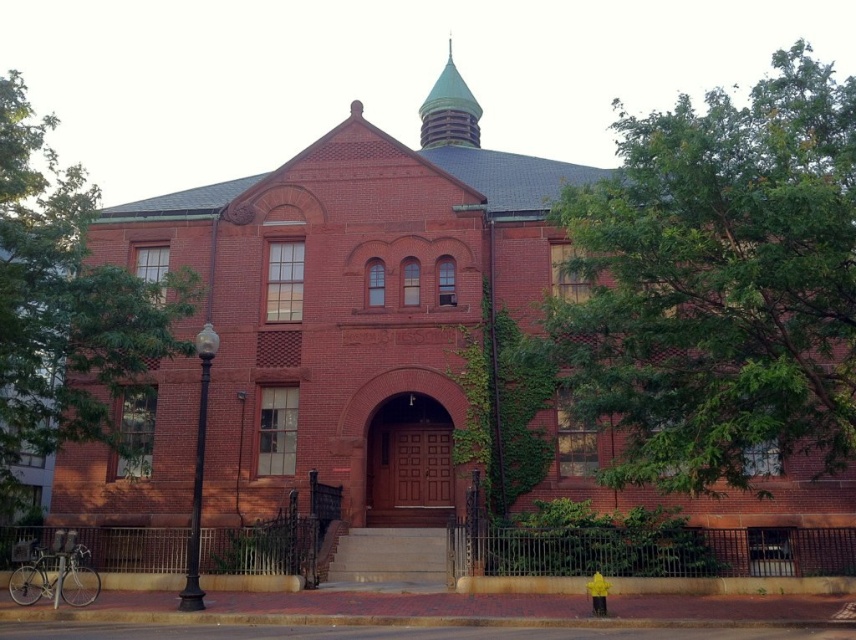
Between point (137, 385) and point (461, 104), which one is positioned behind?

The point (461, 104) is behind.

Measure the distance between point [177,346] and camera.

They are 79.99 feet apart.

Which is behind, point (37, 348) or point (470, 93)?

The point (470, 93) is behind.

You are a GUI agent. You are given a task and a screenshot of the screen. Output one action in this format:
    pyautogui.click(x=<x>, y=<y>)
    Task: Click on the green leafy tree at left
    
    Given the screenshot: What is the action you would take?
    [x=64, y=305]

Is green leafy tree at upper right positioned behind green copper spire at upper center?

No, it is in front of green copper spire at upper center.

Does green leafy tree at upper right have a lesser height compared to green copper spire at upper center?

In fact, green leafy tree at upper right may be taller than green copper spire at upper center.

Is point (750, 397) farther from viewer compared to point (453, 102)?

No, it is not.

At what (x,y) coordinates should I click in order to perform the action: click on green leafy tree at upper right. Please return your answer as a coordinate pair (x, y). The image size is (856, 640). Looking at the image, I should click on click(x=718, y=284).

Does point (548, 324) come closer to viewer compared to point (52, 301)?

Yes, point (548, 324) is in front of point (52, 301).

Is green leafy tree at upper right bigger than green leafy tree at left?

Yes, green leafy tree at upper right is bigger than green leafy tree at left.

The image size is (856, 640). What do you see at coordinates (718, 284) in the screenshot?
I see `green leafy tree at upper right` at bounding box center [718, 284].

In order to click on green leafy tree at upper right in this screenshot , I will do `click(718, 284)`.